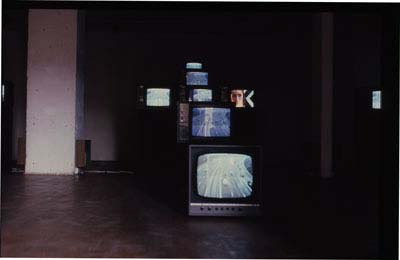
Locate an element on the screen. screen is located at coordinates (234, 175).